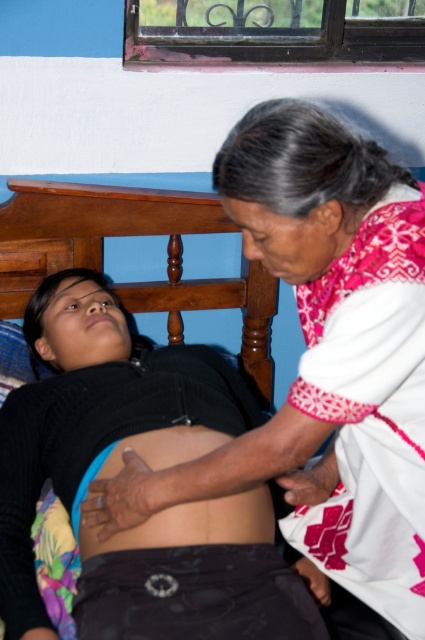
Who is more distant from viewer, (413,358) or (189,444)?

The point (189,444) is behind.

Is point (278, 193) farther from viewer compared to point (190, 544)?

That is False.

What do you see at coordinates (323, 352) in the screenshot? I see `white embroidered blouse at upper right` at bounding box center [323, 352].

You are a GUI agent. You are given a task and a screenshot of the screen. Output one action in this format:
    pyautogui.click(x=<x>, y=<y>)
    Task: Click on the white embroidered blouse at upper right
    This screenshot has width=425, height=640.
    Given the screenshot: What is the action you would take?
    pyautogui.click(x=323, y=352)

From the picture: Is white embroidered blouse at upper right taller than matte black shirt at center?

Correct, white embroidered blouse at upper right is much taller as matte black shirt at center.

Between point (374, 426) and point (132, 424), which one is positioned in front?

Positioned in front is point (374, 426).

Is point (380, 381) positioned after point (189, 592)?

That is False.

Locate an element on the screen. white embroidered blouse at upper right is located at coordinates (323, 352).

Is matte black shirt at center wider than smooth skin at center?

Yes.

Does matte black shirt at center appear on the left side of smooth skin at center?

Indeed, matte black shirt at center is positioned on the left side of smooth skin at center.

Which is behind, point (45, 422) or point (130, 529)?

The point (45, 422) is more distant.

Image resolution: width=425 pixels, height=640 pixels. I want to click on matte black shirt at center, so click(x=153, y=467).